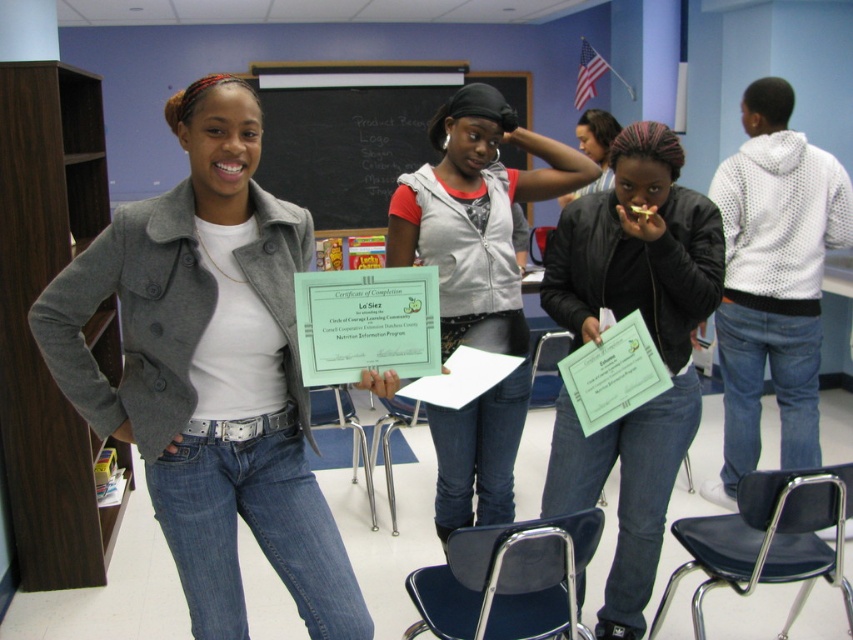
Is matte gray jacket at center positioned behind black leather jacket at center?

No, it is not.

Image resolution: width=853 pixels, height=640 pixels. Describe the element at coordinates (210, 369) in the screenshot. I see `matte gray jacket at center` at that location.

Locate an element on the screen. The width and height of the screenshot is (853, 640). matte gray jacket at center is located at coordinates 210,369.

Who is positioned more to the left, matte gray jacket at center or green paper certificate at center?

From the viewer's perspective, matte gray jacket at center appears more on the left side.

The width and height of the screenshot is (853, 640). Describe the element at coordinates (210, 369) in the screenshot. I see `matte gray jacket at center` at that location.

This screenshot has width=853, height=640. What are the coordinates of `matte gray jacket at center` in the screenshot? It's located at (210, 369).

Does black leather jacket at center appear on the right side of blackboard at upper center?

Indeed, black leather jacket at center is positioned on the right side of blackboard at upper center.

Is black leather jacket at center wider than blackboard at upper center?

No.

Which is behind, point (593, 324) or point (383, 140)?

Point (383, 140)

Where is `black leather jacket at center`? The height and width of the screenshot is (640, 853). black leather jacket at center is located at coordinates (653, 342).